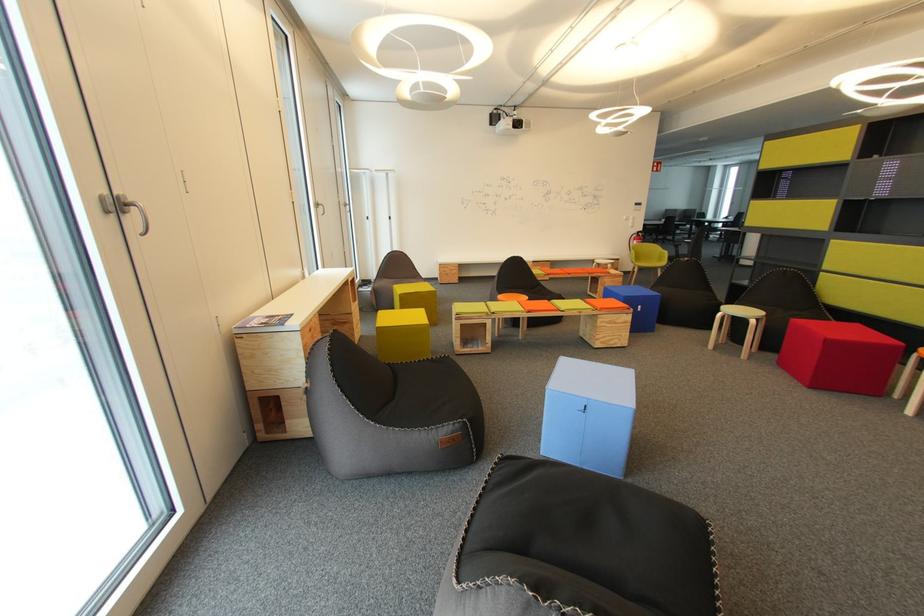
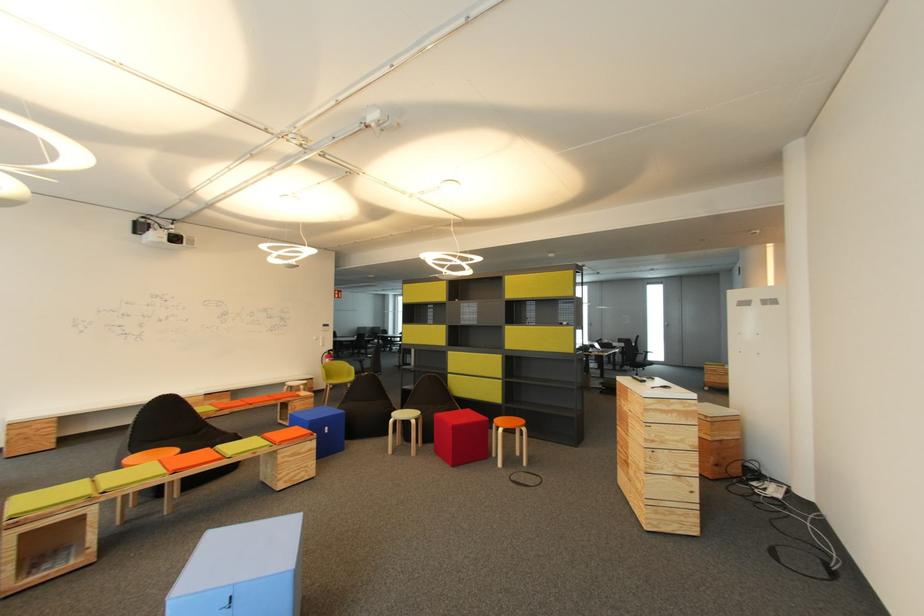
Question: How did the camera likely rotate?

Choices:
 (A) Left
 (B) Right
 (C) Up
 (D) Down

Answer: (B)